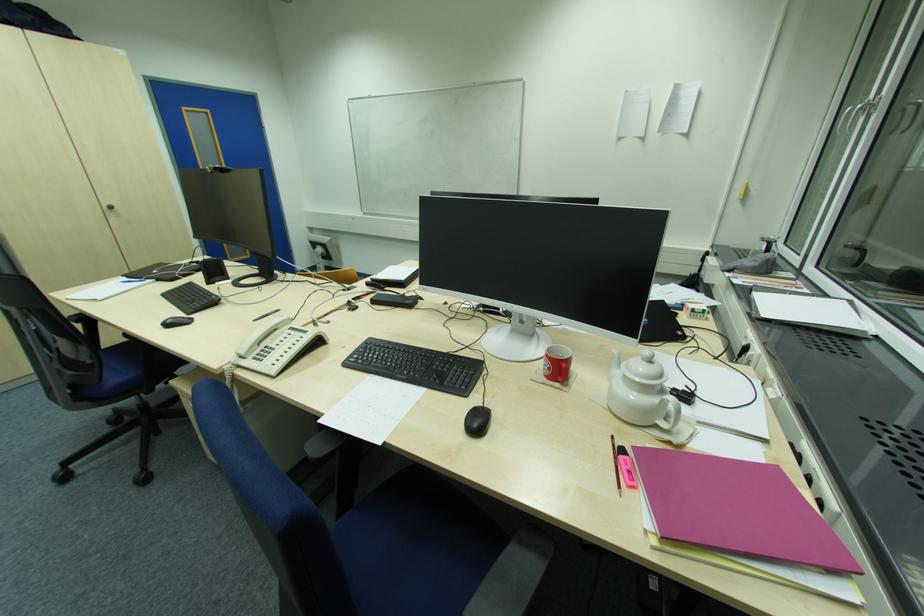
What do you see at coordinates (402, 536) in the screenshot?
I see `a blue chair sitting surface` at bounding box center [402, 536].